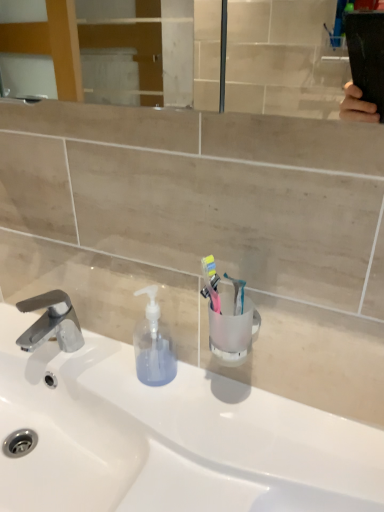
Identify the location of vacant area that lies between transparent plastic soap dispenser at center and chrome metallic faucet at left. (100, 369).